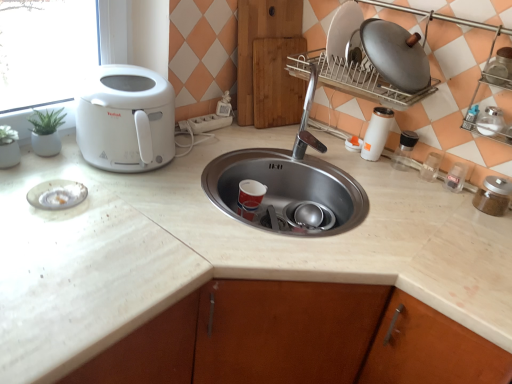
Question: Considering the positions of point (371, 132) and point (457, 173), is point (371, 132) closer or farther from the camera than point (457, 173)?

Choices:
 (A) farther
 (B) closer

Answer: (A)

Question: From a real-world perspective, is white glossy thermos at right, arranged as the 2th appliance when viewed from the left, positioned above or below clear plastic container at right, which is the 4th appliance from right to left?

Choices:
 (A) above
 (B) below

Answer: (A)

Question: Which object is positioned closest to the brown glass jar at right, acting as the first appliance starting from the right?

Choices:
 (A) white glossy thermos at right, arranged as the 2th appliance when viewed from the left
 (B) clear glass bottle at right, the sixth appliance when ordered from right to left
 (C) white plastic toaster at left
 (D) white marble countertop at center
 (E) metallic silver pot at upper right, which is counted as the sixth appliance, starting from the left

Answer: (B)

Question: Estimate the real-world distances between objects in this image. Which object is closer to the white glossy thermos at right, the seventh appliance positioned from the right?

Choices:
 (A) clear plastic container at right, arranged as the fifth appliance when viewed from the left
 (B) transparent plastic container at right, which is counted as the 5th appliance, starting from the right
 (C) white plastic toaster at left
 (D) brown glass jar at right, the 8th appliance positioned from the left
 (E) wooden cutting board at center

Answer: (B)